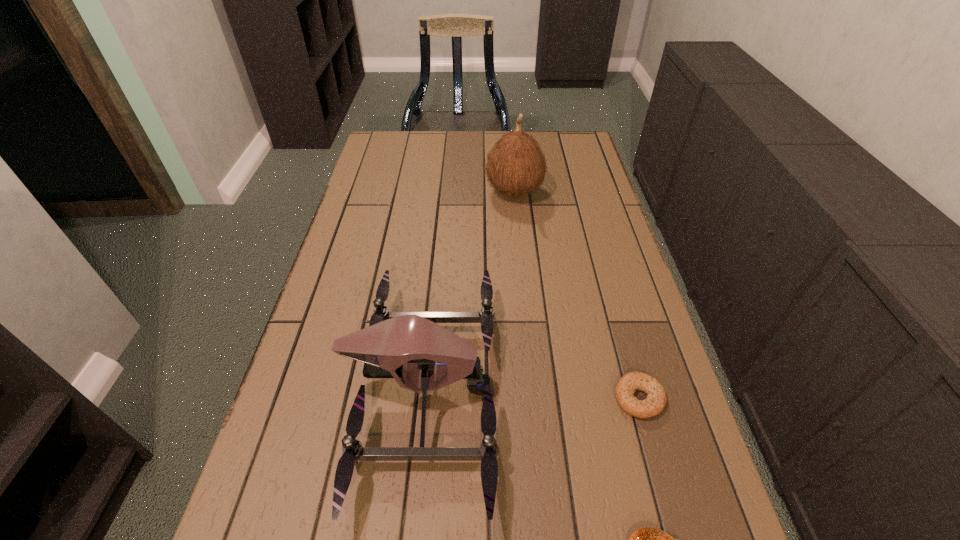
This screenshot has width=960, height=540. Identify the location of object that is positioned at the right edge. (656, 399).

Locate an element on the screen. The image size is (960, 540). vacant space at the left edge of the desktop is located at coordinates (300, 401).

The width and height of the screenshot is (960, 540). What are the coordinates of `vacant space at the right edge of the desktop` in the screenshot? It's located at (698, 537).

At what (x,y) coordinates should I click in order to perform the action: click on free region at the far left corner of the desktop. Please return your answer as a coordinate pair (x, y). The width and height of the screenshot is (960, 540). Looking at the image, I should click on (401, 144).

Locate an element on the screen. vacant region at the far right corner of the desktop is located at coordinates (584, 138).

Where is `unoccupied area between the farther bagel and the third shortest object`? This screenshot has width=960, height=540. unoccupied area between the farther bagel and the third shortest object is located at coordinates (531, 394).

In order to click on free space between the farthest object and the farther bagel in this screenshot , I will do `click(577, 295)`.

The width and height of the screenshot is (960, 540). In order to click on vacant space that's between the farther bagel and the drone in this screenshot , I will do `click(531, 394)`.

The image size is (960, 540). In order to click on vacant point located between the second tallest object and the coconut in this screenshot , I will do `click(468, 291)`.

I want to click on vacant point located between the farther bagel and the farthest object, so click(577, 295).